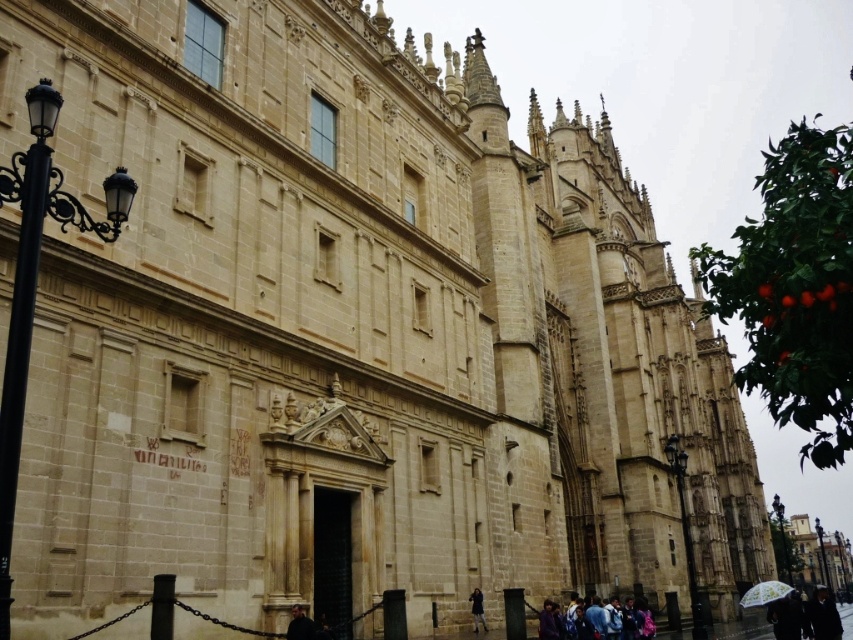
Question: Is the position of denim jacket at lower center more distant than that of dark gray stone person at lower center?

Choices:
 (A) no
 (B) yes

Answer: (A)

Question: Which of the following is the closest to the observer?

Choices:
 (A) (480, 616)
 (B) (776, 580)
 (C) (595, 611)

Answer: (A)

Question: Considering the relative positions of denim jacket at lower center and white lace umbrella at lower right in the image provided, where is denim jacket at lower center located with respect to white lace umbrella at lower right?

Choices:
 (A) right
 (B) left

Answer: (B)

Question: In this image, where is white lace umbrella at lower right located relative to dark gray fabric jacket at lower center?

Choices:
 (A) left
 (B) right

Answer: (B)

Question: Estimate the real-world distances between objects in this image. Which object is closer to the dark gray stone person at lower center?

Choices:
 (A) white lace umbrella at lower right
 (B) denim jacket at lower center
 (C) dark gray fabric jacket at lower center
 (D) green leafy tree with small orange fruits at right

Answer: (B)

Question: Considering the real-world distances, which object is closest to the dark gray stone person at lower center?

Choices:
 (A) denim jacket at lower center
 (B) dark gray fabric jacket at lower center
 (C) green leafy tree with small orange fruits at right
 (D) white lace umbrella at lower right

Answer: (A)